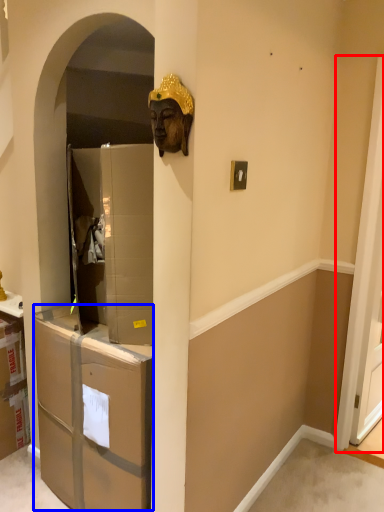
Question: Which object appears farthest to the camera in this image, screen door (highlighted by a red box) or drawer (highlighted by a blue box)?

Choices:
 (A) screen door
 (B) drawer

Answer: (A)